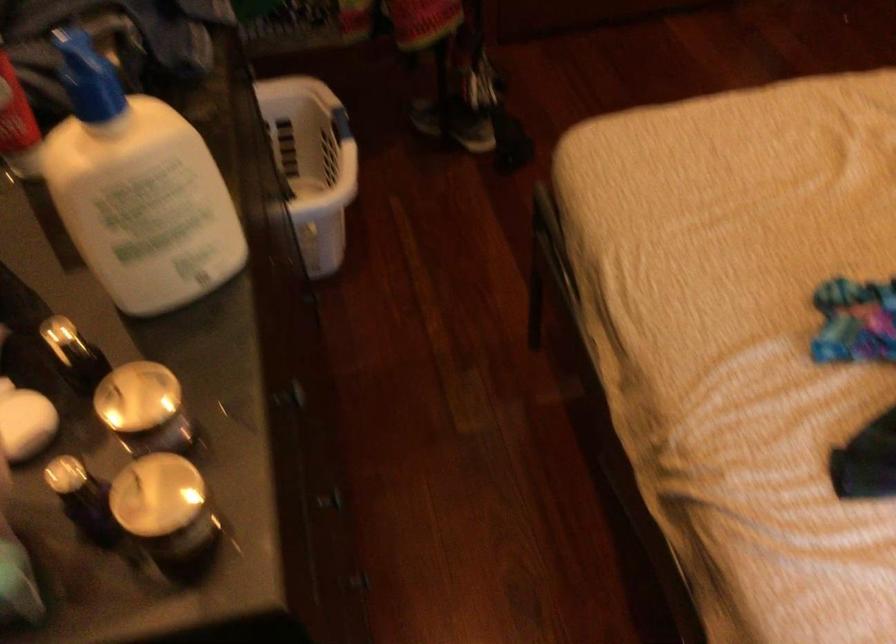
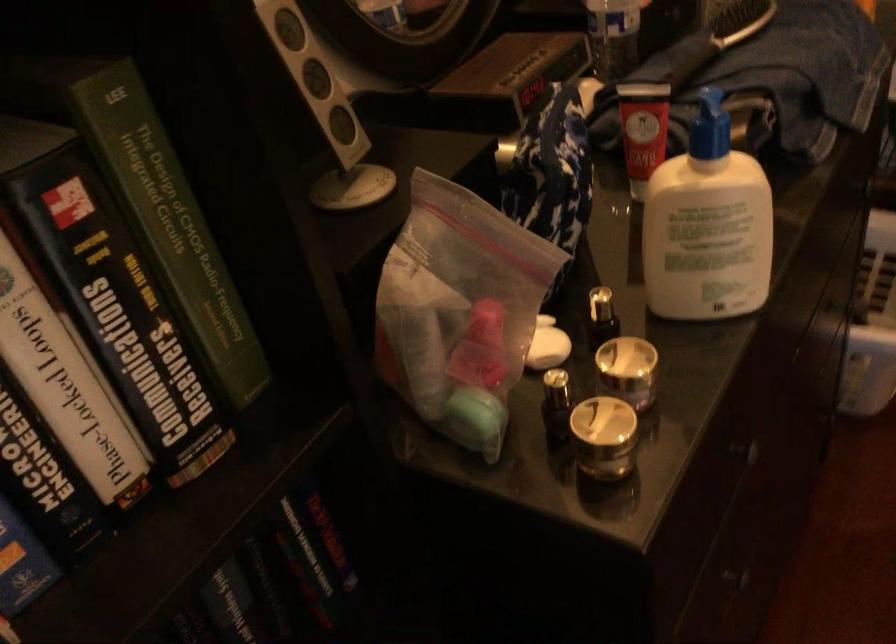
Question: The images are taken continuously from a first-person perspective. In which direction is your viewpoint rotating?

Choices:
 (A) Left
 (B) Right
 (C) Up
 (D) Down

Answer: (A)